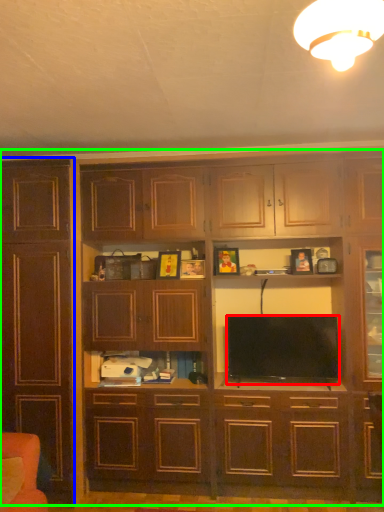
Question: Which object is positioned farthest from television (highlighted by a red box)? Select from cabinetry (highlighted by a blue box) and cupboard (highlighted by a green box).

Choices:
 (A) cabinetry
 (B) cupboard

Answer: (A)